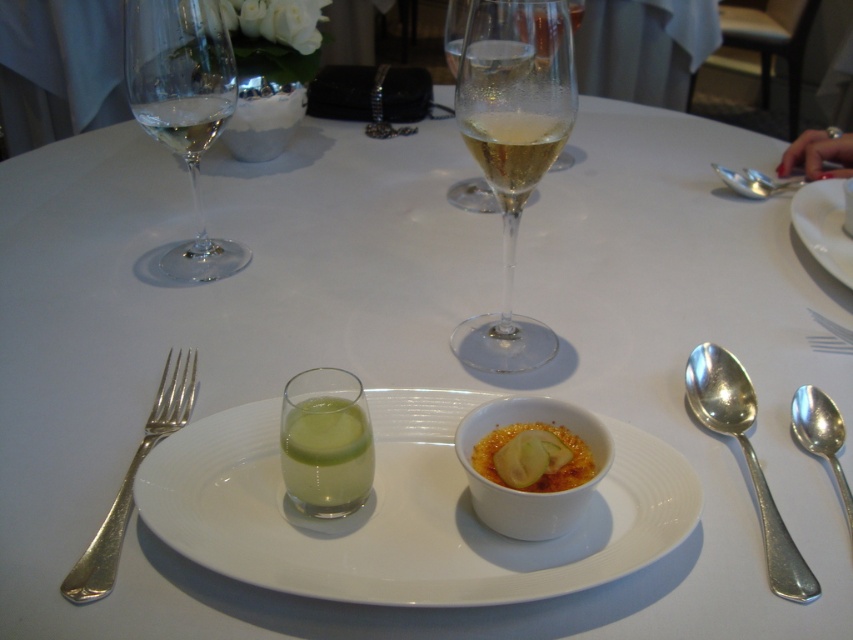
You are a server at a restaurant and need to place a new dessert on the table. The dessert requires a space larger than the clear glass wine at center. Is there enough space on the white porcelain plate at upper right to accommodate it?

The clear glass wine at center has a smaller size compared to the white porcelain plate at upper right, so the dessert requiring space larger than the wine glass can fit on the white porcelain plate at upper right.

You are a server at a restaurant and need to determine which wine glass to use for a guest. The guest prefers a taller glass. Which one should you choose between the clear glass wine at center and the clear glass wine at upper left?

The clear glass wine at upper left is taller than the clear glass wine at center, so you should choose the clear glass wine at upper left for the guest who prefers a taller glass.